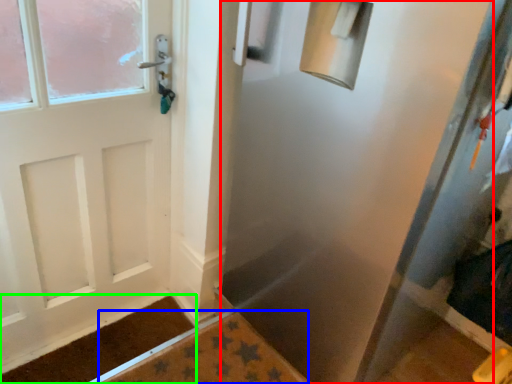
Question: Considering the real-world distances, which object is farthest from screen door (highlighted by a red box)? bath mat (highlighted by a blue box) or doormat (highlighted by a green box)?

Choices:
 (A) bath mat
 (B) doormat

Answer: (B)